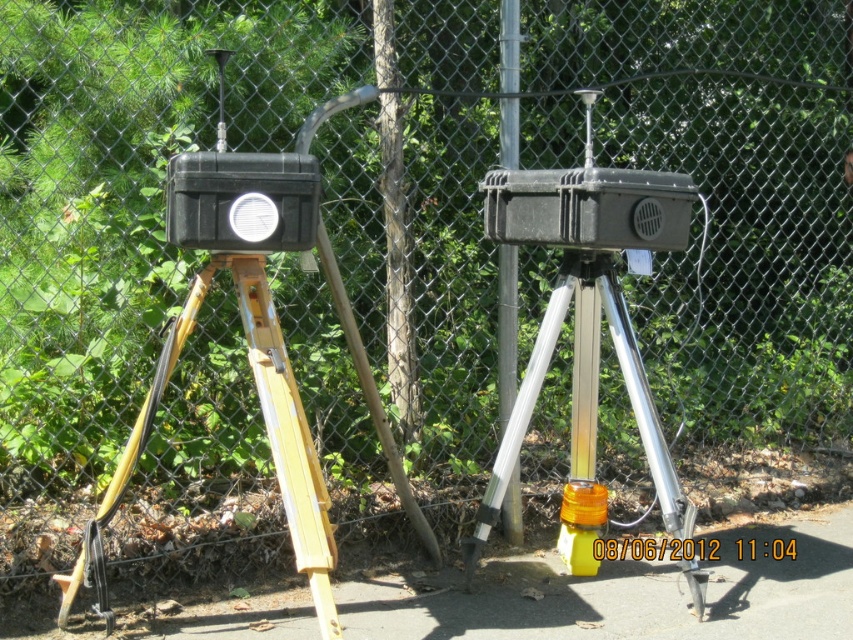
Is silver metallic tripod at center to the left of yellow wood tripod at left from the viewer's perspective?

Incorrect, silver metallic tripod at center is not on the left side of yellow wood tripod at left.

Which is more to the right, silver metallic tripod at center or yellow wood tripod at left?

silver metallic tripod at center is more to the right.

Is point (598, 280) farther from camera compared to point (305, 445)?

That is True.

This screenshot has width=853, height=640. Find the location of `silver metallic tripod at center`. silver metallic tripod at center is located at coordinates coord(584,396).

From the picture: Which is more to the left, silver metallic tripod at center or brushed metal pole at center?

From the viewer's perspective, brushed metal pole at center appears more on the left side.

Who is taller, silver metallic tripod at center or brushed metal pole at center?

brushed metal pole at center

In order to click on silver metallic tripod at center in this screenshot , I will do `click(584, 396)`.

Can you confirm if yellow wood tripod at left is bigger than brushed metal pole at center?

Yes.

What do you see at coordinates (276, 422) in the screenshot? The height and width of the screenshot is (640, 853). I see `yellow wood tripod at left` at bounding box center [276, 422].

Locate an element on the screen. yellow wood tripod at left is located at coordinates (276, 422).